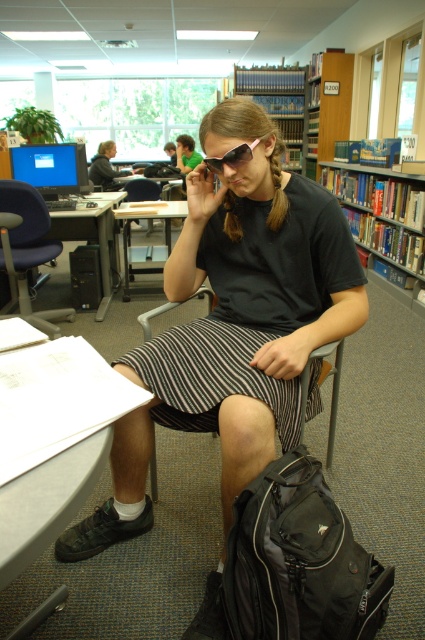
Between matte black laptop at left and green fabric shirt at center, which one appears on the left side from the viewer's perspective?

matte black laptop at left is more to the left.

Locate an element on the screen. The width and height of the screenshot is (425, 640). matte black laptop at left is located at coordinates (104, 166).

Does blue hardcover books at upper right have a larger size compared to matte black chair at left?

Indeed, blue hardcover books at upper right has a larger size compared to matte black chair at left.

Can you confirm if blue hardcover books at upper right is wider than matte black chair at left?

In fact, blue hardcover books at upper right might be narrower than matte black chair at left.

Is point (359, 218) farther from viewer compared to point (8, 266)?

Yes, point (359, 218) is farther from viewer.

I want to click on blue hardcover books at upper right, so click(385, 225).

Is blue hardcover books at upper right thinner than green fabric shirt at center?

Indeed, blue hardcover books at upper right has a lesser width compared to green fabric shirt at center.

Which is below, blue hardcover books at upper right or green fabric shirt at center?

Positioned lower is blue hardcover books at upper right.

Which is in front, point (402, 212) or point (172, 161)?

Point (402, 212) is in front.

You are a GUI agent. You are given a task and a screenshot of the screen. Output one action in this format:
    pyautogui.click(x=<x>, y=<y>)
    Task: Click on the blue hardcover books at upper right
    
    Given the screenshot: What is the action you would take?
    pyautogui.click(x=385, y=225)